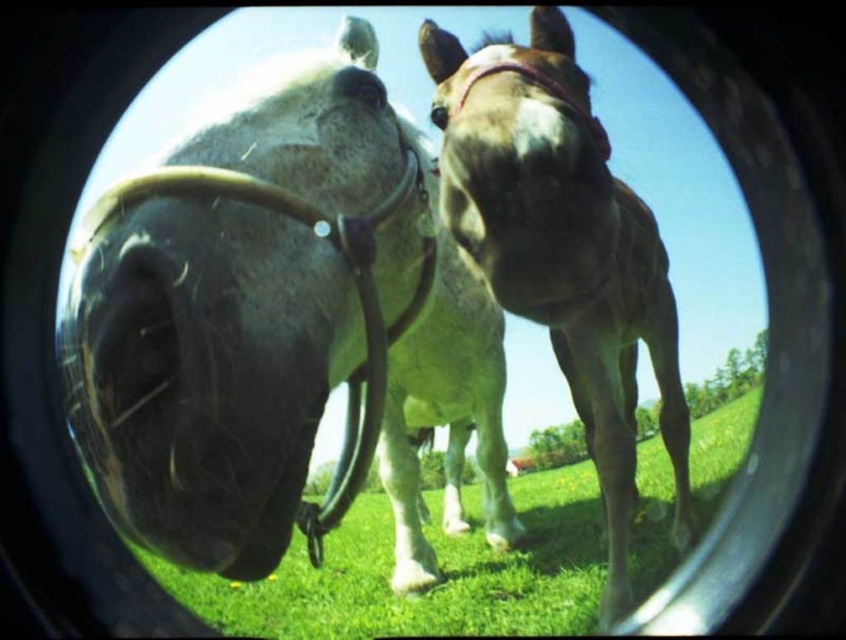
Question: Is green grass at lower center further to the viewer compared to black leather nose at center?

Choices:
 (A) yes
 (B) no

Answer: (A)

Question: Which point is closer to the camera?

Choices:
 (A) green grass at lower center
 (B) shiny black horse at center
 (C) brown glossy horse at center
 (D) black leather nose at center

Answer: (D)

Question: Does brown glossy horse at center come behind black leather nose at center?

Choices:
 (A) yes
 (B) no

Answer: (A)

Question: Is shiny black horse at center wider than brown glossy horse at center?

Choices:
 (A) yes
 (B) no

Answer: (A)

Question: Which of these objects is positioned closest to the brown glossy horse at center?

Choices:
 (A) black leather nose at center
 (B) green grass at lower center
 (C) shiny black horse at center

Answer: (C)

Question: Which of the following is the farthest from the observer?

Choices:
 (A) shiny black horse at center
 (B) brown glossy horse at center

Answer: (A)